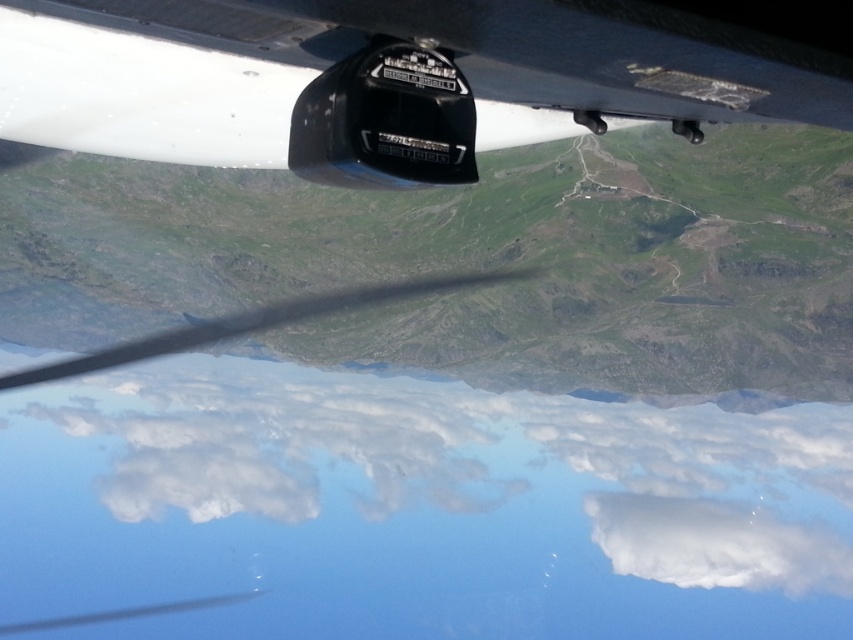
Can you confirm if white fluffy cloud at center is thinner than matte black sensor at center?

No, white fluffy cloud at center is not thinner than matte black sensor at center.

Does point (463, 460) come behind point (735, 51)?

Yes, it is.

Who is more distant from viewer, (537, 522) or (387, 26)?

Positioned behind is point (537, 522).

Locate an element on the screen. This screenshot has width=853, height=640. white fluffy cloud at center is located at coordinates (469, 461).